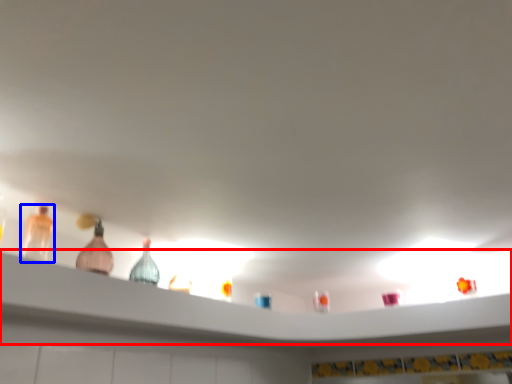
Question: Among these objects, which one is farthest to the camera, shelf (highlighted by a red box) or bottle (highlighted by a blue box)?

Choices:
 (A) shelf
 (B) bottle

Answer: (B)